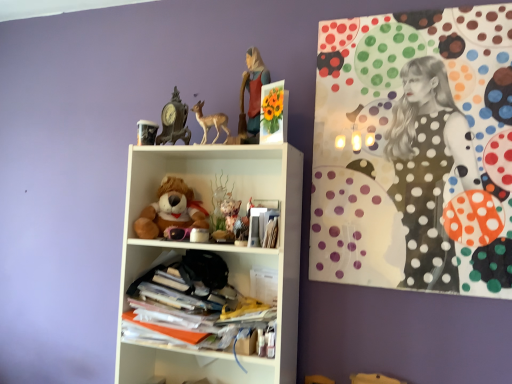
Where is `free point behind antique bronze clock at upper center`? free point behind antique bronze clock at upper center is located at coordinates (182, 152).